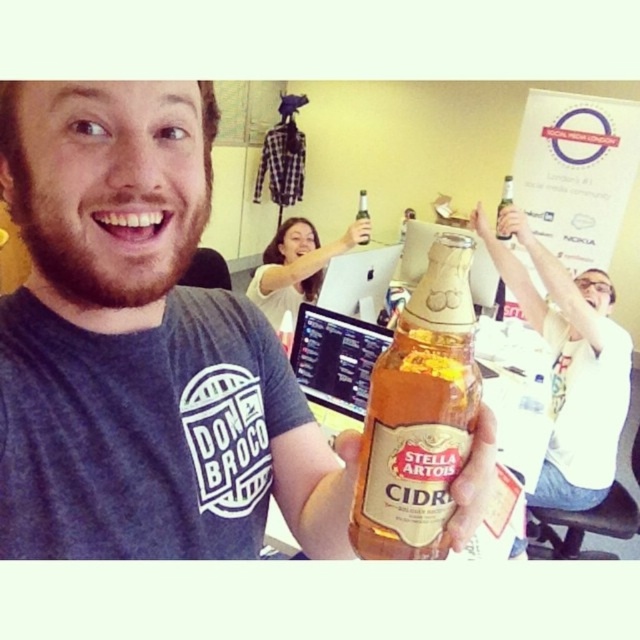
You are standing in the office scene and notice two items in the image. One is the white matte shirt at upper right and the other is the translucent glass bottle at center. Based on their positions, which item is located to the right of the other?

The white matte shirt at upper right is located to the right of the translucent glass bottle at center.

You are a photographer standing at the camera position. You want to take a closeup shot of the white matte shirt at upper right. Can you estimate how far you need to move forward to get the subject within the ideal focus range of 1.5 meters?

The white matte shirt at upper right is currently 1.94 meters away from the camera. To bring it within the ideal focus range of 1.5 meters, you need to move forward by approximately 0.44 meters.